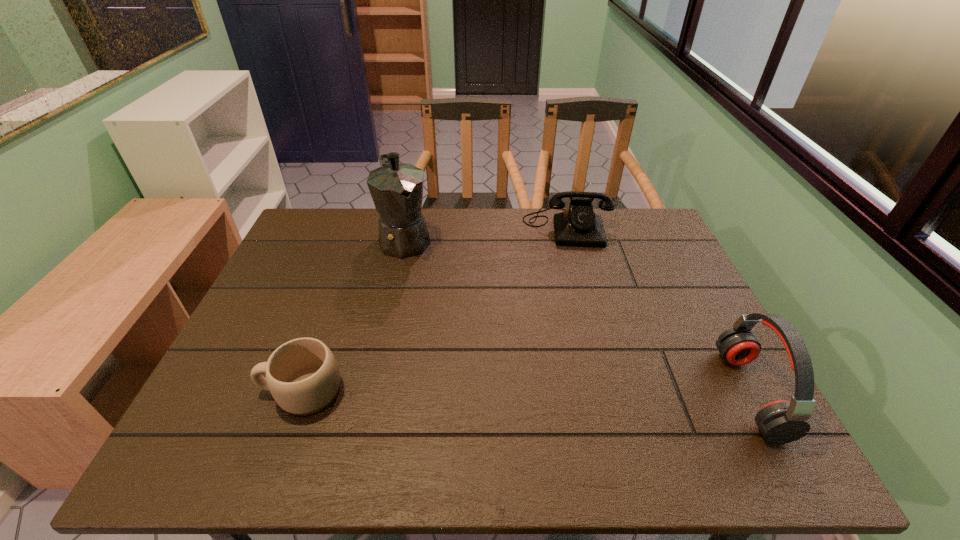
Find the location of a particular element. The image size is (960, 540). vacant space at the near edge of the desktop is located at coordinates (540, 393).

In the image, there is a desktop. Identify the location of vacant area at the left edge. This screenshot has width=960, height=540. (329, 260).

You are a GUI agent. You are given a task and a screenshot of the screen. Output one action in this format:
    pyautogui.click(x=<x>, y=<y>)
    Task: Click on the vacant space at the right edge of the desktop
    The width and height of the screenshot is (960, 540).
    Given the screenshot: What is the action you would take?
    pyautogui.click(x=635, y=282)

Find the location of a particular element. This screenshot has height=540, width=960. vacant space at the far left corner of the desktop is located at coordinates (335, 220).

Identify the location of vacant space at the far right corner of the desktop. This screenshot has height=540, width=960. (642, 230).

The width and height of the screenshot is (960, 540). What are the coordinates of `empty space between the mug and the earphone` in the screenshot? It's located at click(526, 393).

The width and height of the screenshot is (960, 540). What are the coordinates of `vacant area that lies between the second object from right to left and the tallest object` in the screenshot? It's located at (487, 233).

Find the location of `free space between the third object from left to right and the mug`. free space between the third object from left to right and the mug is located at coordinates (434, 309).

Locate an element on the screen. Image resolution: width=960 pixels, height=540 pixels. free space between the rightmost object and the mug is located at coordinates tap(526, 393).

Where is `vacant region between the earphone and the telephone`? The height and width of the screenshot is (540, 960). vacant region between the earphone and the telephone is located at coordinates (659, 310).